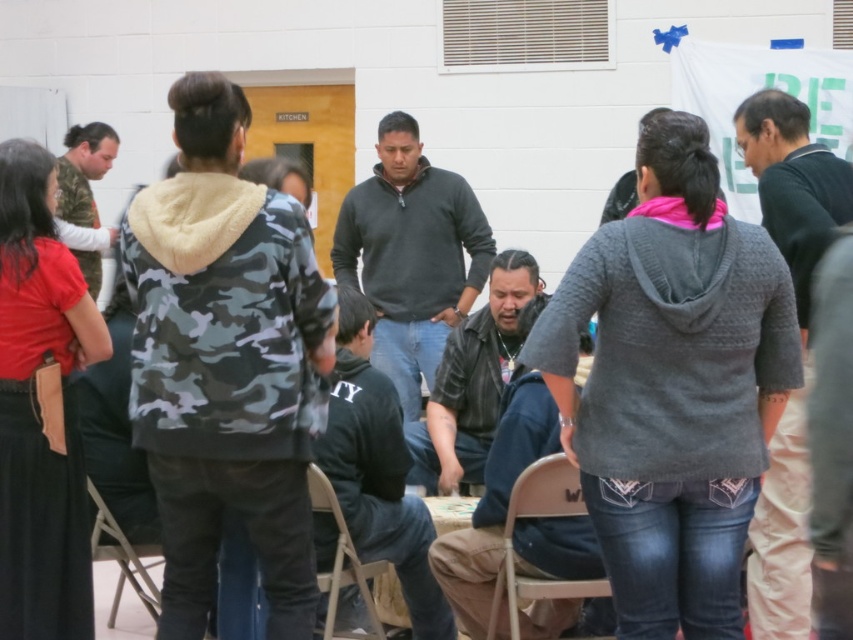
Question: Based on their relative distances, which object is nearer to the black leather jacket at center?

Choices:
 (A) metallic silver chair at lower left
 (B) red cotton shirt at left

Answer: (A)

Question: Estimate the real-world distances between objects in this image. Which object is closer to the knit gray sweater at right?

Choices:
 (A) dark gray sweater at center
 (B) camouflage jacket at left
 (C) leather jacket at center

Answer: (C)

Question: Is knit gray sweater at center closer to the viewer compared to camo-patterned hoodie at center?

Choices:
 (A) no
 (B) yes

Answer: (B)

Question: Can you confirm if red cotton shirt at left is positioned to the right of camouflage jacket at left?

Choices:
 (A) yes
 (B) no

Answer: (A)

Question: Which of these objects is positioned closest to the camouflage jacket at left?

Choices:
 (A) dark gray sweater at center
 (B) camo-patterned hoodie at center
 (C) light brown fabric chair at lower center
 (D) metallic silver chair at lower left

Answer: (A)

Question: Is knit gray sweater at center to the right of red cotton shirt at left from the viewer's perspective?

Choices:
 (A) no
 (B) yes

Answer: (B)